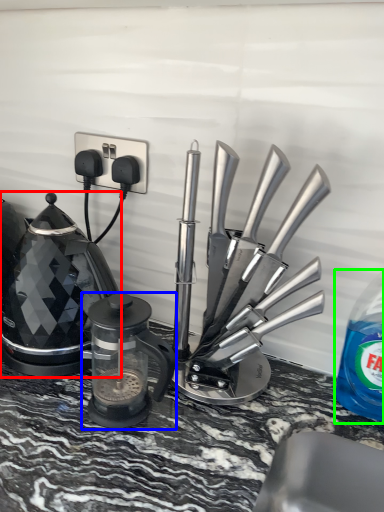
Question: Which is nearer to the kettle (highlighted by a red box)? kitchen appliance (highlighted by a blue box) or bottle (highlighted by a green box).

Choices:
 (A) kitchen appliance
 (B) bottle

Answer: (A)